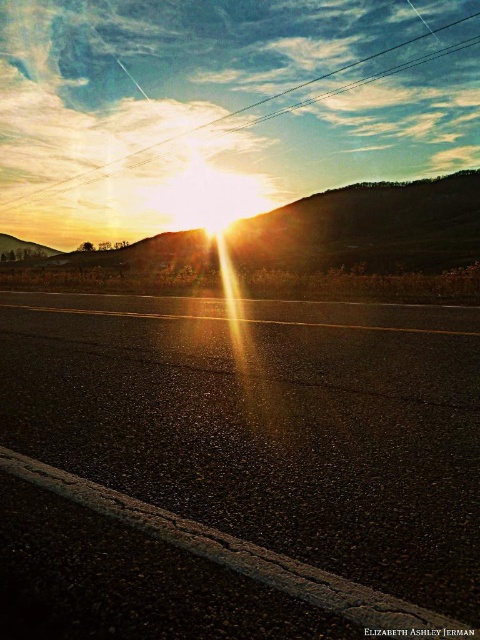
From the picture: Is black asphalt highway at center to the left of metallic wire at upper center from the viewer's perspective?

Yes, black asphalt highway at center is to the left of metallic wire at upper center.

Is black asphalt highway at center thinner than metallic wire at upper center?

Yes, black asphalt highway at center is thinner than metallic wire at upper center.

Is point (456, 362) positioned after point (62, 189)?

No.

You are a GUI agent. You are given a task and a screenshot of the screen. Output one action in this format:
    pyautogui.click(x=<x>, y=<y>)
    Task: Click on the black asphalt highway at center
    
    Given the screenshot: What is the action you would take?
    pyautogui.click(x=267, y=422)